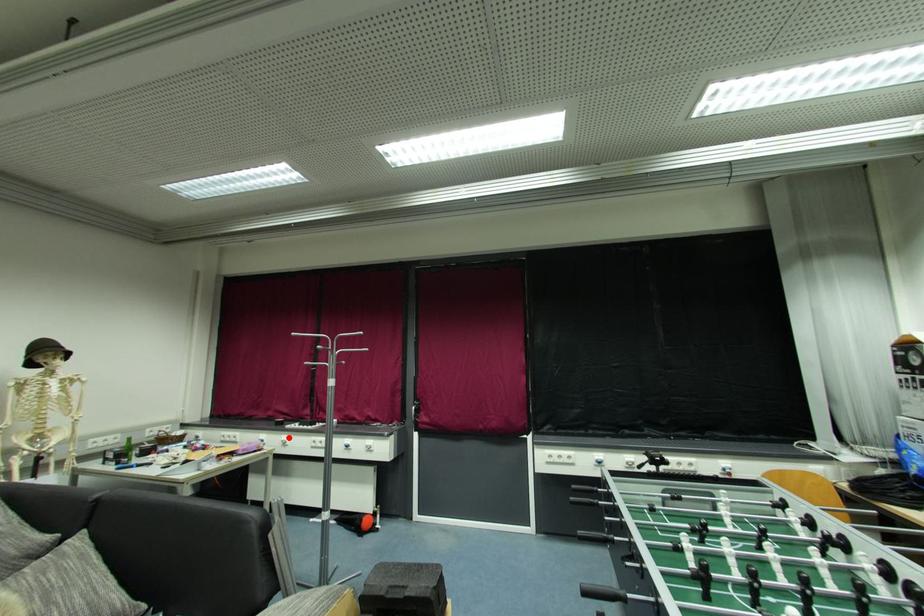
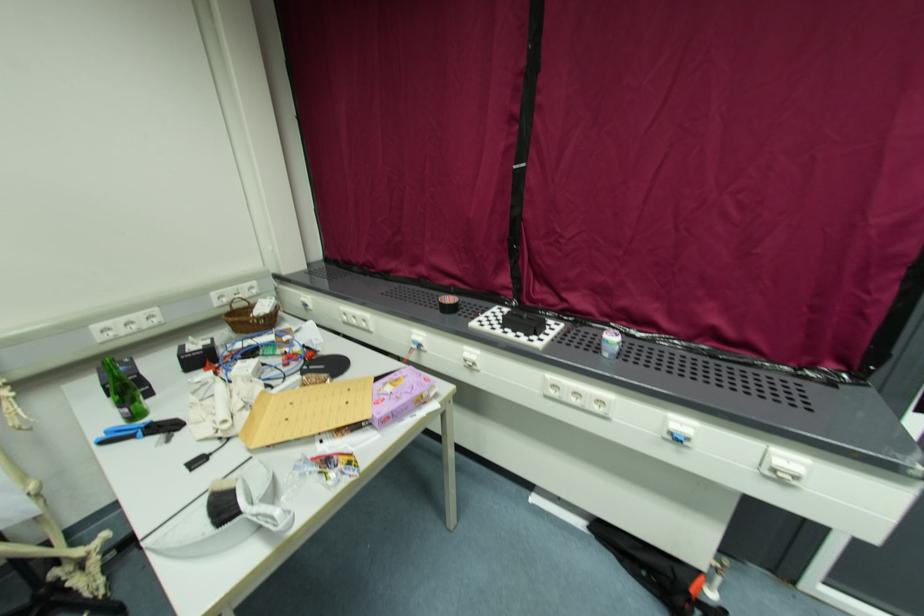
Question: I am providing you with two images of the same scene from different viewpoints. Given a red point in image1, look at the same physical point in image2. Is it:

Choices:
 (A) Closer to the viewpoint
 (B) Farther from the viewpoint

Answer: (A)